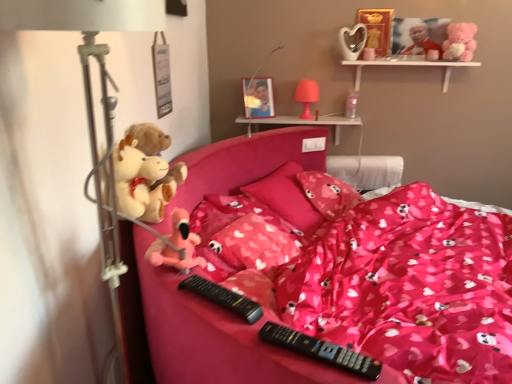
Question: From the image's perspective, is black plastic remote at center, which ranks as the first remote in back-to-front order, located beneath pink fabric pillow at center, the 3th pillow positioned from the front?

Choices:
 (A) no
 (B) yes

Answer: (B)

Question: Can we say black plastic remote at center, positioned as the 2th remote in front-to-back order, lies outside pink fabric pillow at center, the 3th pillow positioned from the front?

Choices:
 (A) yes
 (B) no

Answer: (A)

Question: Is black plastic remote at center, positioned as the 2th remote in front-to-back order, in contact with pink fabric pillow at center, the 3th pillow positioned from the front?

Choices:
 (A) no
 (B) yes

Answer: (A)

Question: Is black plastic remote at center, which ranks as the first remote in back-to-front order, wider than pink fabric pillow at center, the 3th pillow positioned from the front?

Choices:
 (A) no
 (B) yes

Answer: (A)

Question: Is black plastic remote at center, the 1th remote positioned from the left, bigger than pink fabric pillow at center, the 3th pillow positioned from the front?

Choices:
 (A) yes
 (B) no

Answer: (B)

Question: From the image's perspective, is black plastic remote at center, which ranks as the first remote in back-to-front order, located above pink fabric pillow at center, the first pillow from the back?

Choices:
 (A) yes
 (B) no

Answer: (B)

Question: Is transparent plastic cup at upper center, which is the 5th toy from front to back, taller than pink fabric pillow at center, the second pillow when ordered from back to front?

Choices:
 (A) yes
 (B) no

Answer: (B)

Question: Are transparent plastic cup at upper center, which is the 5th toy from front to back, and pink fabric pillow at center, marked as the 2th pillow in a front-to-back arrangement, making contact?

Choices:
 (A) no
 (B) yes

Answer: (A)

Question: Considering the relative sizes of transparent plastic cup at upper center, acting as the third toy starting from the bottom, and pink fabric pillow at center, marked as the 2th pillow in a front-to-back arrangement, in the image provided, is transparent plastic cup at upper center, acting as the third toy starting from the bottom, shorter than pink fabric pillow at center, marked as the 2th pillow in a front-to-back arrangement,?

Choices:
 (A) yes
 (B) no

Answer: (A)

Question: Is transparent plastic cup at upper center, positioned as the third toy in top-to-bottom order, smaller than pink fabric pillow at center, the second pillow when ordered from back to front?

Choices:
 (A) no
 (B) yes

Answer: (B)

Question: Is transparent plastic cup at upper center, positioned as the third toy in top-to-bottom order, oriented towards pink fabric pillow at center, the second pillow when ordered from back to front?

Choices:
 (A) yes
 (B) no

Answer: (B)

Question: From the image's perspective, would you say transparent plastic cup at upper center, arranged as the 3th toy when viewed from the right, is positioned over pink fabric pillow at center, marked as the 2th pillow in a front-to-back arrangement?

Choices:
 (A) no
 (B) yes

Answer: (B)

Question: Is white wooden shelf at upper right, the first shelf in the top-to-bottom sequence, at the left side of pink fabric pillow at center, the second pillow when ordered from back to front?

Choices:
 (A) yes
 (B) no

Answer: (B)